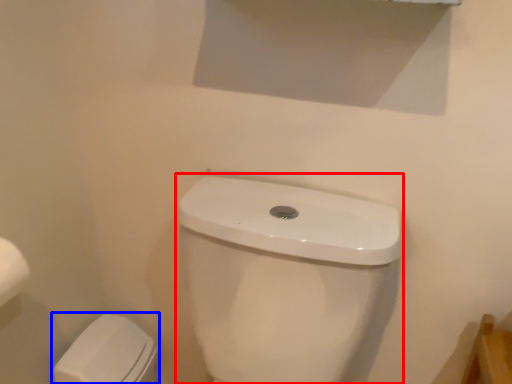
Question: Which object is closer to the camera taking this photo, sink (highlighted by a red box) or porcelain (highlighted by a blue box)?

Choices:
 (A) sink
 (B) porcelain

Answer: (A)